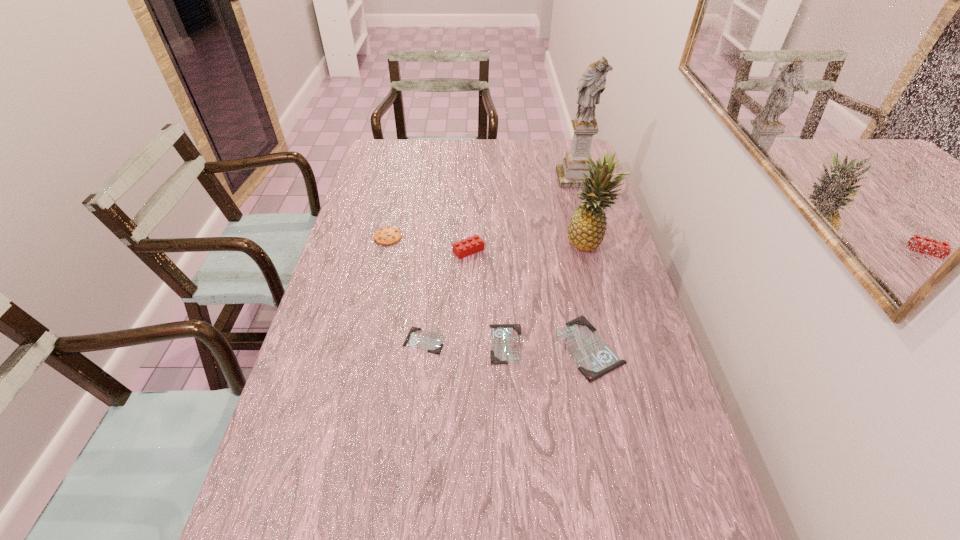
Locate an element on the screen. This screenshot has width=960, height=540. object that can be found as the sixth closest to the sixth shortest object is located at coordinates (387, 235).

Identify the location of object that ranks as the fourth closest to the shortest identity card. The width and height of the screenshot is (960, 540). 387,235.

Find the location of a particular element. The height and width of the screenshot is (540, 960). identity card that is the third closest to the third object from left to right is located at coordinates (595, 358).

Where is `identity card identified as the closest to the rightmost identity card`? identity card identified as the closest to the rightmost identity card is located at coordinates (506, 347).

The height and width of the screenshot is (540, 960). Find the location of `free space that satisfies the following two spatial constraints: 1. on the back side of the leftmost identity card; 2. on the left side of the fifth shortest object`. free space that satisfies the following two spatial constraints: 1. on the back side of the leftmost identity card; 2. on the left side of the fifth shortest object is located at coordinates (434, 251).

You are a GUI agent. You are given a task and a screenshot of the screen. Output one action in this format:
    pyautogui.click(x=<x>, y=<y>)
    Task: Click on the free space that satisfies the following two spatial constraints: 1. on the back side of the sixth shortest object; 2. on the right side of the fifth tallest object
    Image resolution: width=960 pixels, height=540 pixels.
    Given the screenshot: What is the action you would take?
    pyautogui.click(x=566, y=243)